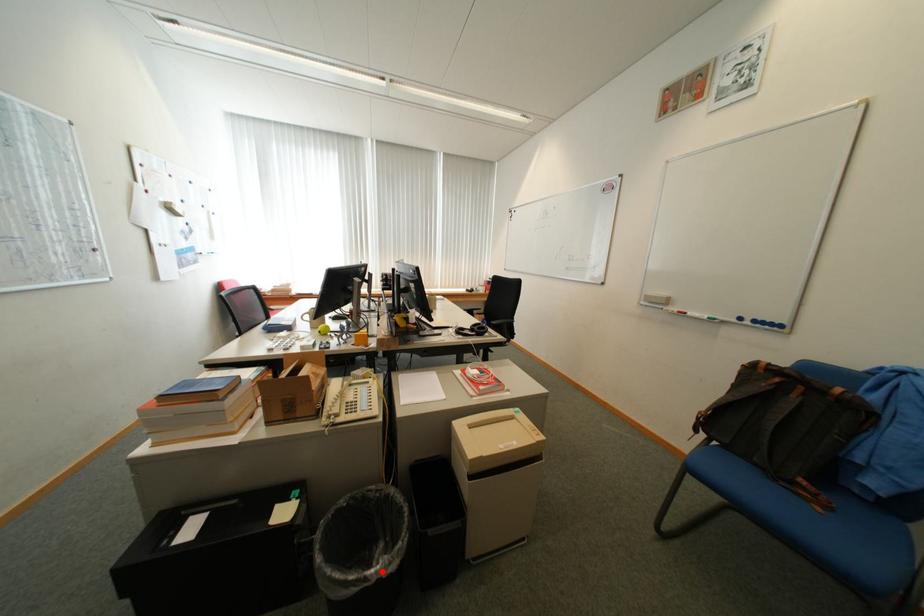
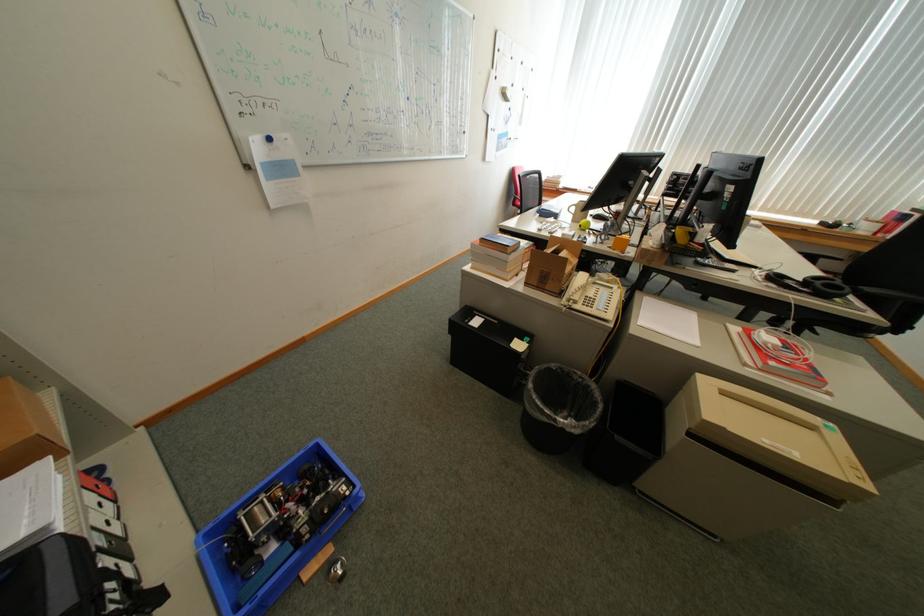
Where in the second image is the point corresponding to the highlighted location from the first image?

(572, 421)